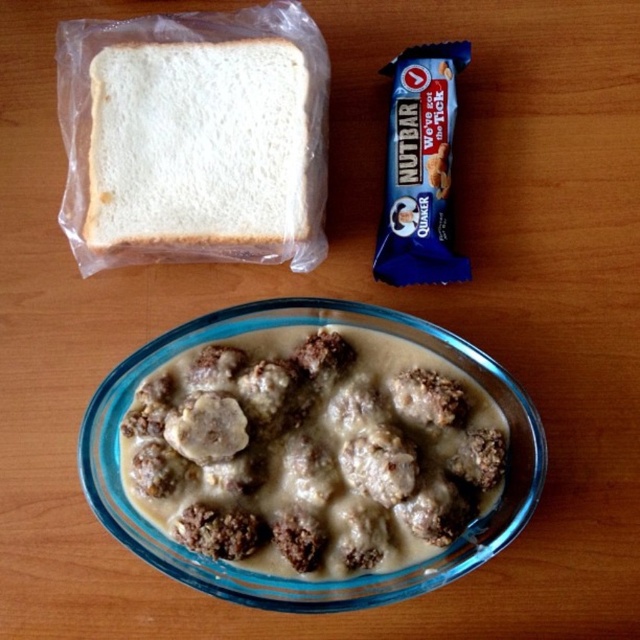
Describe the element at coordinates (310, 451) in the screenshot. I see `brown crumbly meatballs at center` at that location.

In the scene shown: Between brown crumbly meatballs at center and white matte bread at upper left, which one has more height?

brown crumbly meatballs at center is taller.

Who is more forward, [403,340] or [177,68]?

Positioned in front is point [177,68].

The image size is (640, 640). I want to click on brown crumbly meatballs at center, so click(310, 451).

Does brown crumbly meatballs at center appear over blue wrapper bar at upper right?

No, brown crumbly meatballs at center is not above blue wrapper bar at upper right.

Measure the distance between brown crumbly meatballs at center and camera.

brown crumbly meatballs at center is 3.35 feet from camera.

Which is in front, point (176, 513) or point (401, 172)?

Point (176, 513) is in front.

Where is `brown crumbly meatballs at center`? brown crumbly meatballs at center is located at coordinates (310, 451).

Which of these two, white matte bread at upper left or blue wrapper bar at upper right, stands shorter?

white matte bread at upper left

What do you see at coordinates (196, 144) in the screenshot? I see `white matte bread at upper left` at bounding box center [196, 144].

Image resolution: width=640 pixels, height=640 pixels. I want to click on white matte bread at upper left, so click(x=196, y=144).